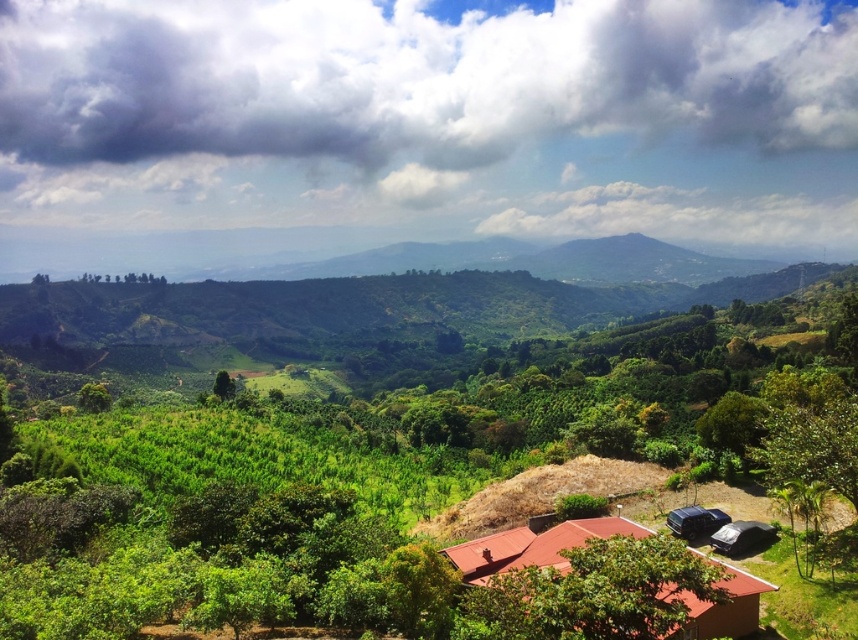
Question: Considering the relative positions of cloudy sky at upper center and green leafy tree at center in the image provided, where is cloudy sky at upper center located with respect to green leafy tree at center?

Choices:
 (A) below
 (B) above

Answer: (B)

Question: Based on their relative distances, which object is farther from the green leafy tree at center-left?

Choices:
 (A) green leafy tree at center
 (B) cloudy sky at upper center
 (C) brown corrugated roof hut at lower right

Answer: (B)

Question: Which object is the closest to the green leafy tree at center?

Choices:
 (A) cloudy sky at upper center
 (B) green leafy tree at center-left
 (C) brown corrugated roof hut at lower right

Answer: (B)

Question: Which point is farther to the camera?

Choices:
 (A) (599, 531)
 (B) (41, 195)

Answer: (B)

Question: In this image, where is cloudy sky at upper center located relative to brown corrugated roof hut at lower right?

Choices:
 (A) right
 (B) left

Answer: (B)

Question: Is green leafy tree at center-left to the right of green leafy tree at center from the viewer's perspective?

Choices:
 (A) yes
 (B) no

Answer: (B)